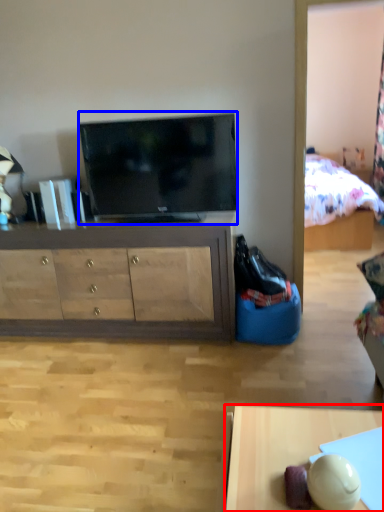
Question: Which of the following is the farthest to the observer, desk (highlighted by a red box) or television (highlighted by a blue box)?

Choices:
 (A) desk
 (B) television

Answer: (B)